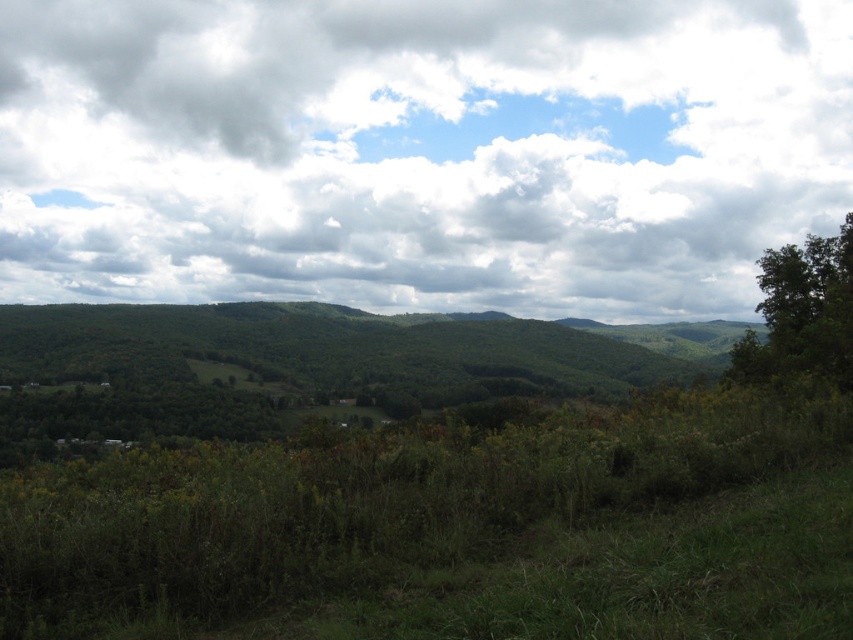
You are an airplane pilot flying over the landscape. You see the white fluffy cloud at upper center and the green leafy tree at right. Which object is closer to your current altitude?

The green leafy tree at right is behind the white fluffy cloud at upper center, meaning the cloud is closer to your altitude than the tree.

Based on the photo, you are an airplane pilot flying over a rural landscape. You notice a white fluffy cloud at upper center and a green leafy tree at right. Which object is located to the left of the other?

The white fluffy cloud at upper center is positioned on the left side of green leafy tree at right.

You are an astronomer analyzing the image. You need to locate the white fluffy cloud at upper center. What are its coordinates?

The white fluffy cloud at upper center is located at coordinates point [419,150].